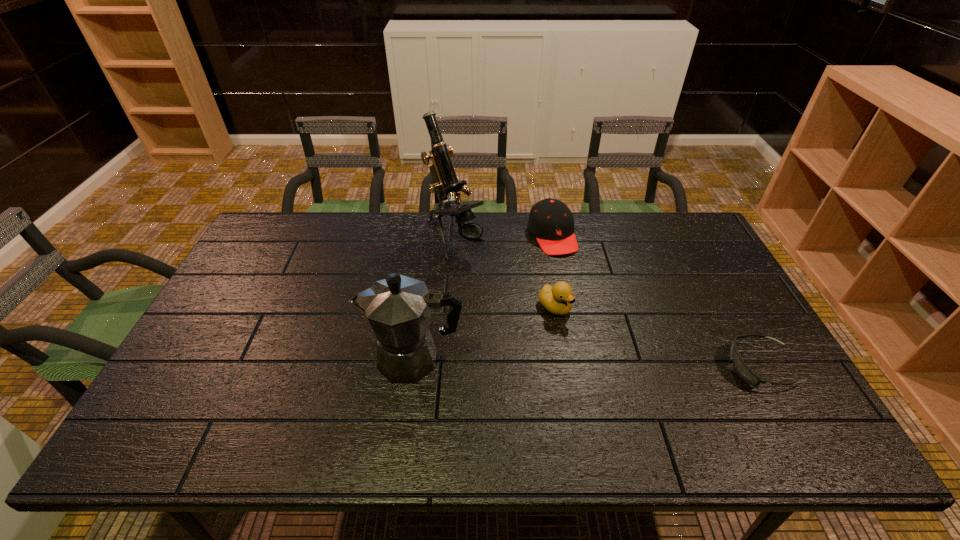
Where is `free location located 0.080m on the lenses of the rightmost object`? This screenshot has width=960, height=540. free location located 0.080m on the lenses of the rightmost object is located at coordinates (698, 367).

Locate an element on the screen. The width and height of the screenshot is (960, 540). vacant space located 0.270m on the lenses of the rightmost object is located at coordinates (624, 367).

What are the coordinates of `free region located 0.330m through the eyepiece of the tallest object` in the screenshot? It's located at (532, 323).

The height and width of the screenshot is (540, 960). Identify the location of vacant space situated 0.250m through the eyepiece of the tallest object. (515, 306).

The height and width of the screenshot is (540, 960). In order to click on free spot located through the eyepiece of the tallest object in this screenshot , I will do `click(516, 308)`.

At what (x,y) coordinates should I click in order to perform the action: click on vacant space located on the face of the duckling. Please return your answer as a coordinate pair (x, y). The width and height of the screenshot is (960, 540). Looking at the image, I should click on (638, 375).

I want to click on vacant space located on the face of the duckling, so click(642, 377).

Image resolution: width=960 pixels, height=540 pixels. I want to click on vacant space located on the face of the duckling, so click(623, 362).

Locate an element on the screen. This screenshot has width=960, height=540. vacant space located 0.090m on the front-facing side of the cap is located at coordinates (571, 274).

You are a GUI agent. You are given a task and a screenshot of the screen. Output one action in this format:
    pyautogui.click(x=<x>, y=<y>)
    Task: Click on the free space located on the front-facing side of the cap
    This screenshot has width=960, height=540.
    Given the screenshot: What is the action you would take?
    pyautogui.click(x=612, y=352)